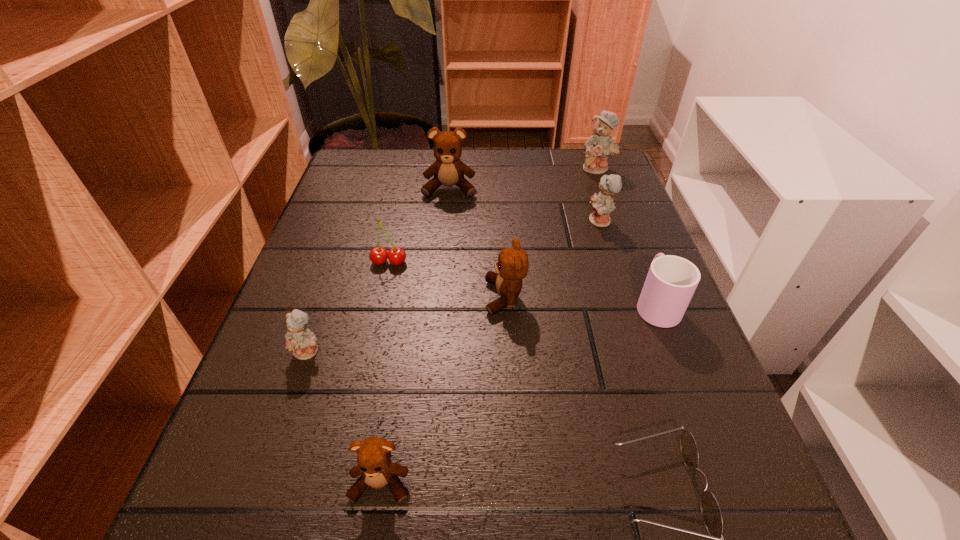
Find the location of a particular element. vacant space situated on the front-facing side of the fourth farthest teddy bear is located at coordinates point(318,297).

The image size is (960, 540). In order to click on free space located on the front-facing side of the fourth farthest teddy bear in this screenshot , I will do `click(307, 297)`.

I want to click on free space located on the front-facing side of the fourth farthest teddy bear, so click(301, 297).

You are a GUI agent. You are given a task and a screenshot of the screen. Output one action in this format:
    pyautogui.click(x=<x>, y=<y>)
    Task: Click on the vacant region located 0.400m with the handle on the side of the cup
    This screenshot has width=960, height=540.
    Given the screenshot: What is the action you would take?
    pyautogui.click(x=605, y=172)

You are a GUI agent. You are given a task and a screenshot of the screen. Output one action in this format:
    pyautogui.click(x=<x>, y=<y>)
    Task: Click on the vacant point located with the handle on the side of the cup
    The height and width of the screenshot is (540, 960).
    Given the screenshot: What is the action you would take?
    pyautogui.click(x=607, y=177)

Identify the location of vacant point located with the handle on the side of the cup. This screenshot has height=540, width=960. (619, 209).

You are a GUI agent. You are given a task and a screenshot of the screen. Output one action in this format:
    pyautogui.click(x=<x>, y=<y>)
    Task: Click on the vacant space located 0.060m with the stems of the cherry pointing upwards
    
    Given the screenshot: What is the action you would take?
    pyautogui.click(x=383, y=291)

This screenshot has height=540, width=960. What are the coordinates of `vacant space located on the front-facing side of the nearest blue teddy bear` in the screenshot? It's located at (266, 475).

Identify the location of object that is at the near edge. Image resolution: width=960 pixels, height=540 pixels. (374, 460).

The height and width of the screenshot is (540, 960). I want to click on cherry positioned at the left edge, so click(x=378, y=255).